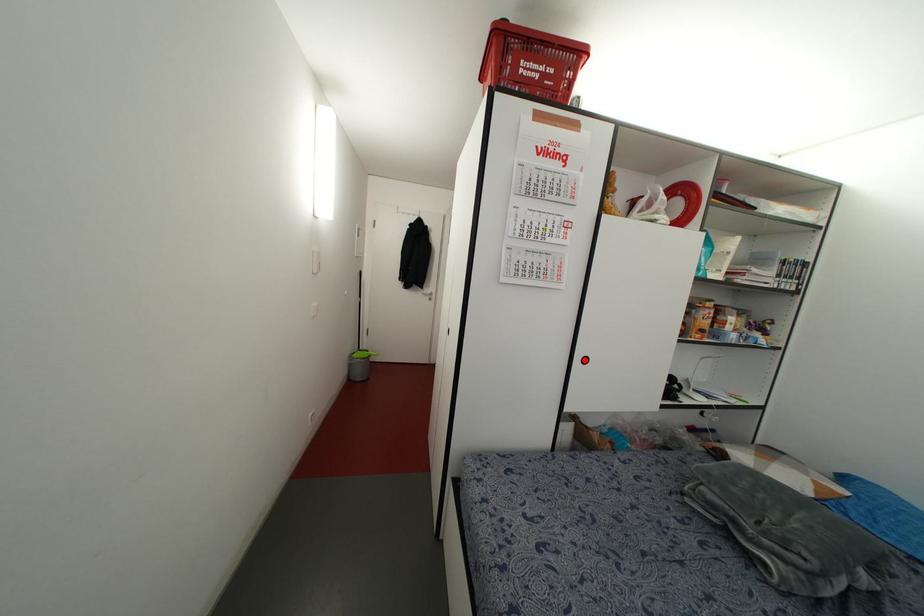
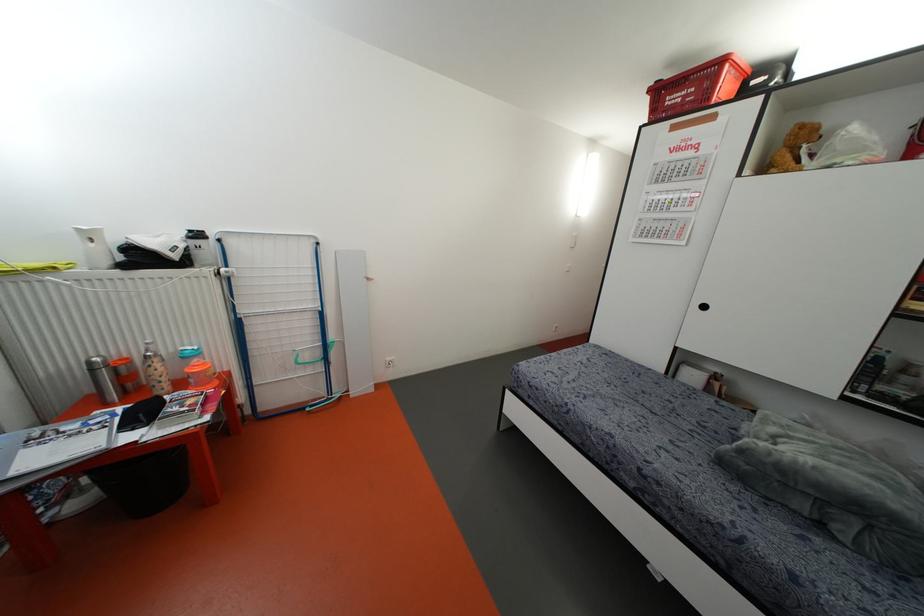
The point at the highlighted location is marked in the first image. Where is the corresponding point in the second image?

(703, 307)